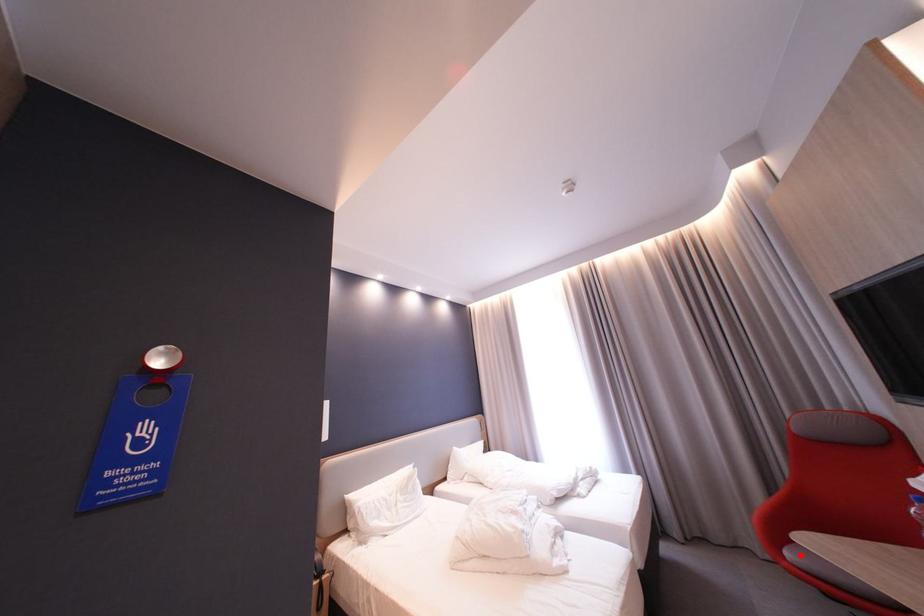
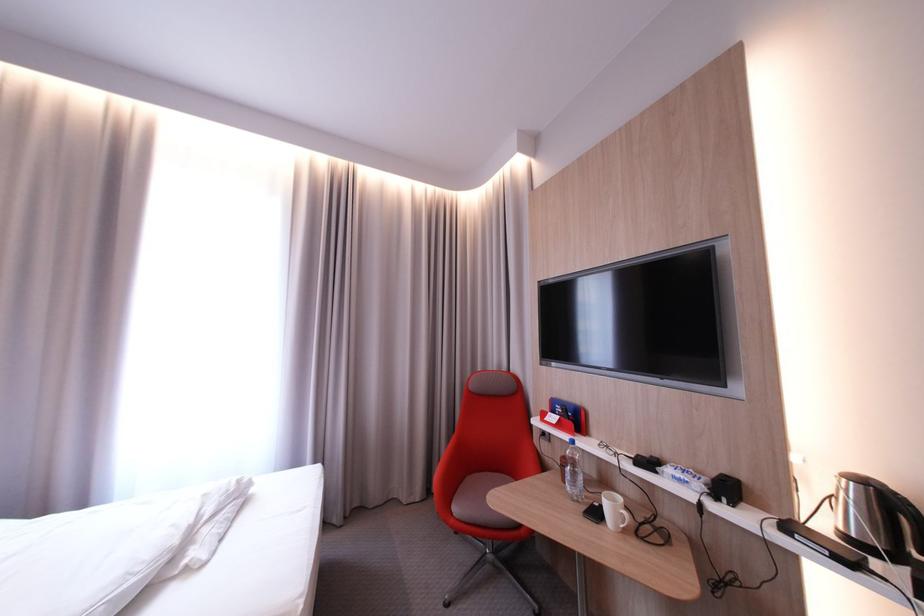
Where in the second image is the point corresponding to the highlighted location from the first image?

(467, 511)